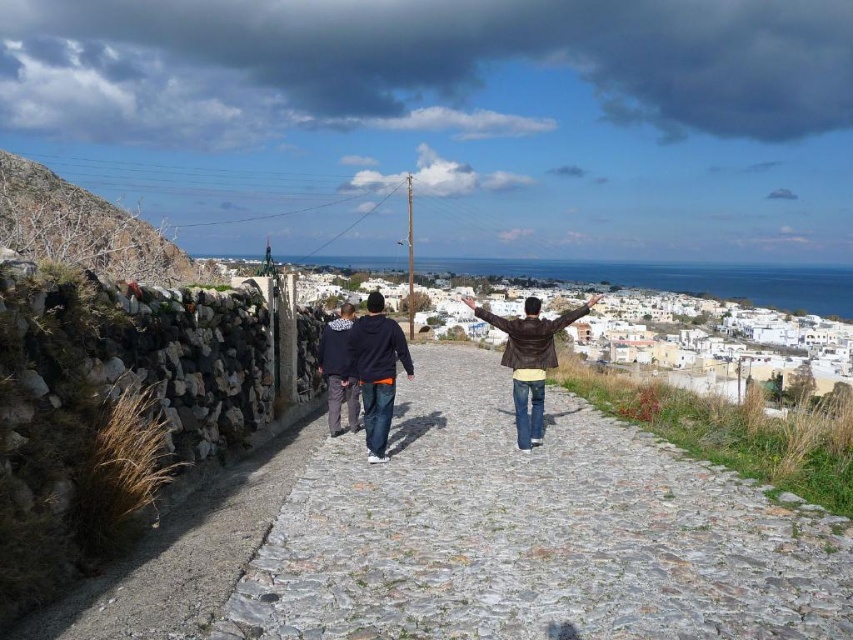
Question: In this image, where is brown rocky hill at left located relative to brown leather jacket at center?

Choices:
 (A) above
 (B) below

Answer: (A)

Question: Which is farther from the gray cobblestone path at center?

Choices:
 (A) brown rocky hill at left
 (B) brown leather jacket at center

Answer: (A)

Question: Which object is farther from the camera taking this photo?

Choices:
 (A) brown rocky hill at left
 (B) dark blue hoodie at center

Answer: (B)

Question: Which point is closer to the camera?

Choices:
 (A) (512, 392)
 (B) (126, 273)
 (C) (405, 358)

Answer: (B)

Question: Can you confirm if gray cobblestone path at center is positioned above brown rocky hill at left?

Choices:
 (A) yes
 (B) no

Answer: (B)

Question: Is brown rocky hill at left bigger than dark blue hoodie at center?

Choices:
 (A) yes
 (B) no

Answer: (A)